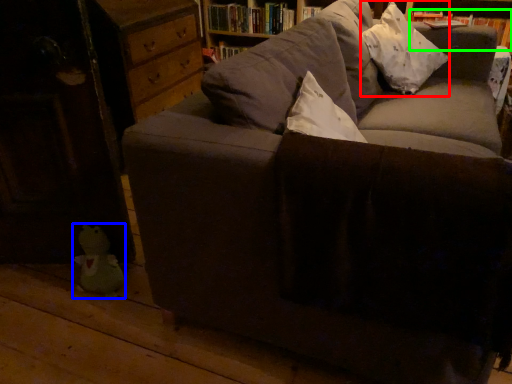
Question: Estimate the real-world distances between objects in this image. Which object is farther from throw pillow (highlighted by a red box), toy (highlighted by a blue box) or book (highlighted by a green box)?

Choices:
 (A) toy
 (B) book

Answer: (A)